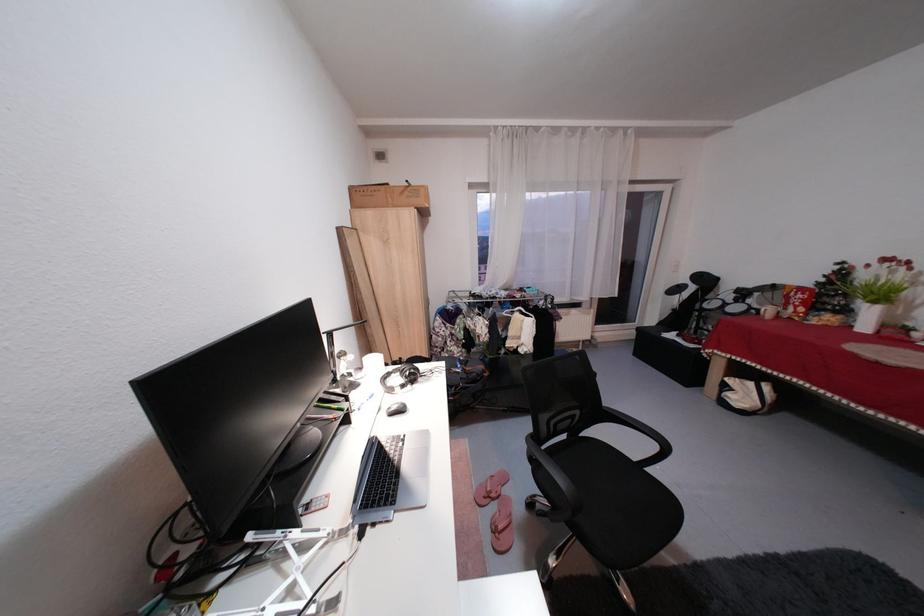
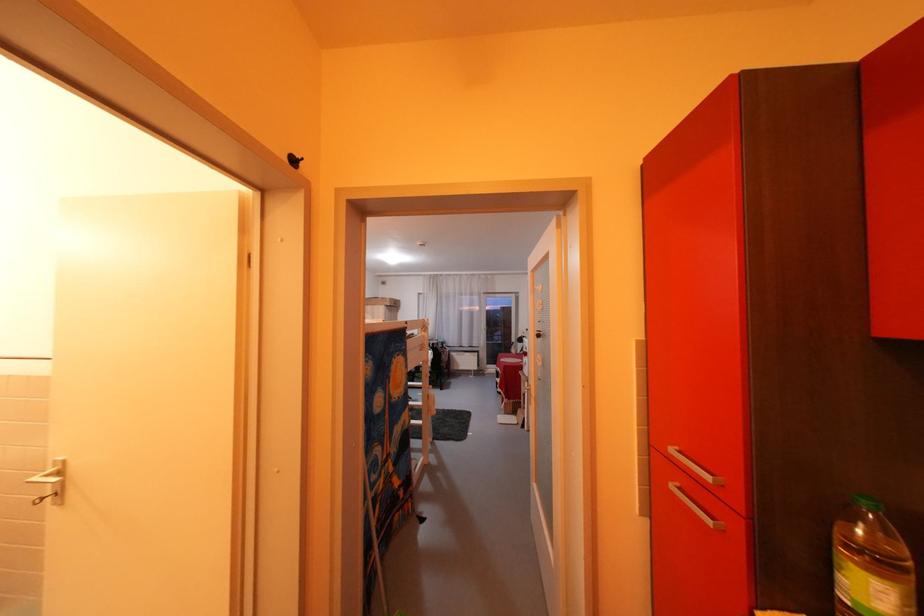
What movement of the cameraman would produce the second image?

The cameraman walked toward right, backward.